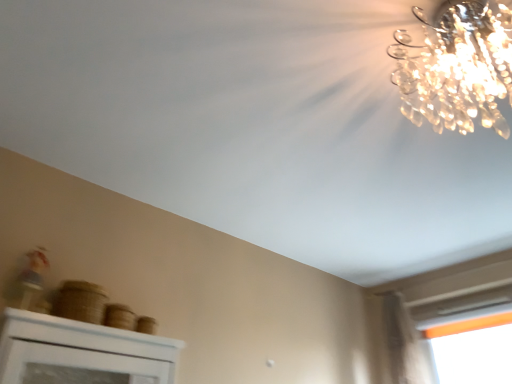
The height and width of the screenshot is (384, 512). What do you see at coordinates (403, 342) in the screenshot?
I see `satin beige curtain at lower right` at bounding box center [403, 342].

At what (x,y) coordinates should I click in order to perform the action: click on satin beige curtain at lower right. Please return your answer as a coordinate pair (x, y). The image size is (512, 384). Looking at the image, I should click on (403, 342).

This screenshot has width=512, height=384. In order to click on satin beige curtain at lower right in this screenshot , I will do `click(403, 342)`.